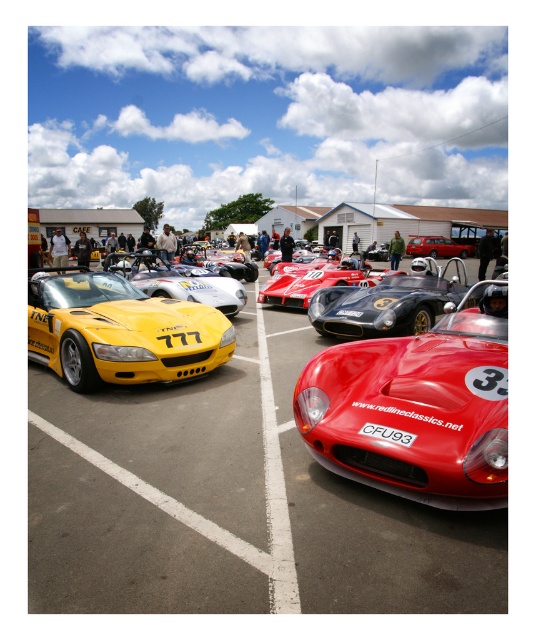
You are a photographer at the car show and want to capture both the shiny red racing car at center and the yellow matte sports car at center in a single frame. Given that the camera can only focus on objects within a 10m distance, will both cars fit in the frame if they are placed 8 meters apart from each other?

The shiny red racing car at center has a smaller size compared to yellow matte sports car at center. Since the total distance between them is 8 meters, which is less than the camera focus range of 10 meters, both cars will fit within the frame.

You are a photographer planning to take a group photo of the shiny red racing car at center and the shiny black race car at center. If you want both cars to appear the same size in the photo, which car should you move closer to the camera?

The shiny red racing car at center is smaller in real life compared to the shiny black race car at center. To make them appear the same size in the photo, you should move the shiny red racing car at center closer to the camera than the shiny black race car at center.

You are standing in the car show and want to take a photo of both point (157, 278) and point (457, 244). Which point is closer to you so that you can focus on it first?

Point (157, 278) is closer to the viewer than point (457, 244), so you should focus on point (157, 278) first.